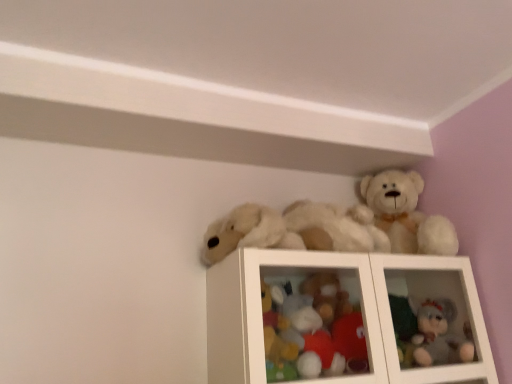
Question: Can you see gray plush bear at upper right, which ranks as the third toy in left-to-right order, touching white plush bear at upper center, which is the first toy in left-to-right order?

Choices:
 (A) yes
 (B) no

Answer: (B)

Question: From a real-world perspective, is gray plush bear at upper right, the first toy positioned from the right, positioned under white plush bear at upper center, which is the first toy in left-to-right order, based on gravity?

Choices:
 (A) yes
 (B) no

Answer: (A)

Question: Is gray plush bear at upper right, which ranks as the third toy in left-to-right order, positioned with its back to white plush bear at upper center, the third toy viewed from the right?

Choices:
 (A) yes
 (B) no

Answer: (B)

Question: From the image's perspective, is gray plush bear at upper right, which ranks as the third toy in left-to-right order, over white plush bear at upper center, which is the first toy in left-to-right order?

Choices:
 (A) yes
 (B) no

Answer: (B)

Question: Can you confirm if gray plush bear at upper right, which ranks as the third toy in left-to-right order, is smaller than white plush bear at upper center, the third toy viewed from the right?

Choices:
 (A) yes
 (B) no

Answer: (A)

Question: Is gray plush bear at upper right, the first toy positioned from the right, in front of white plush bear at upper center, the third toy viewed from the right?

Choices:
 (A) yes
 (B) no

Answer: (B)

Question: Is white plush bear at upper center, which is the first toy in left-to-right order, directly adjacent to fluffy fabric teddy bear at upper right, which is the 2th toy from right to left?

Choices:
 (A) yes
 (B) no

Answer: (B)

Question: Is fluffy fabric teddy bear at upper right, acting as the second toy starting from the left, a part of white plush bear at upper center, which is the first toy in left-to-right order?

Choices:
 (A) yes
 (B) no

Answer: (B)

Question: From the image's perspective, is white plush bear at upper center, which is the first toy in left-to-right order, over fluffy fabric teddy bear at upper right, which is the 2th toy from right to left?

Choices:
 (A) yes
 (B) no

Answer: (A)

Question: From a real-world perspective, is white plush bear at upper center, the third toy viewed from the right, physically above fluffy fabric teddy bear at upper right, which is the 2th toy from right to left?

Choices:
 (A) no
 (B) yes

Answer: (B)

Question: From a real-world perspective, is white plush bear at upper center, which is the first toy in left-to-right order, under fluffy fabric teddy bear at upper right, acting as the second toy starting from the left?

Choices:
 (A) no
 (B) yes

Answer: (A)

Question: Considering the relative positions of white plush bear at upper center, which is the first toy in left-to-right order, and fluffy fabric teddy bear at upper right, which is the 2th toy from right to left, in the image provided, is white plush bear at upper center, which is the first toy in left-to-right order, to the right of fluffy fabric teddy bear at upper right, which is the 2th toy from right to left, from the viewer's perspective?

Choices:
 (A) yes
 (B) no

Answer: (B)

Question: From a real-world perspective, does gray plush bear at upper right, which ranks as the third toy in left-to-right order, stand above fluffy fabric teddy bear at upper right, acting as the second toy starting from the left?

Choices:
 (A) yes
 (B) no

Answer: (B)